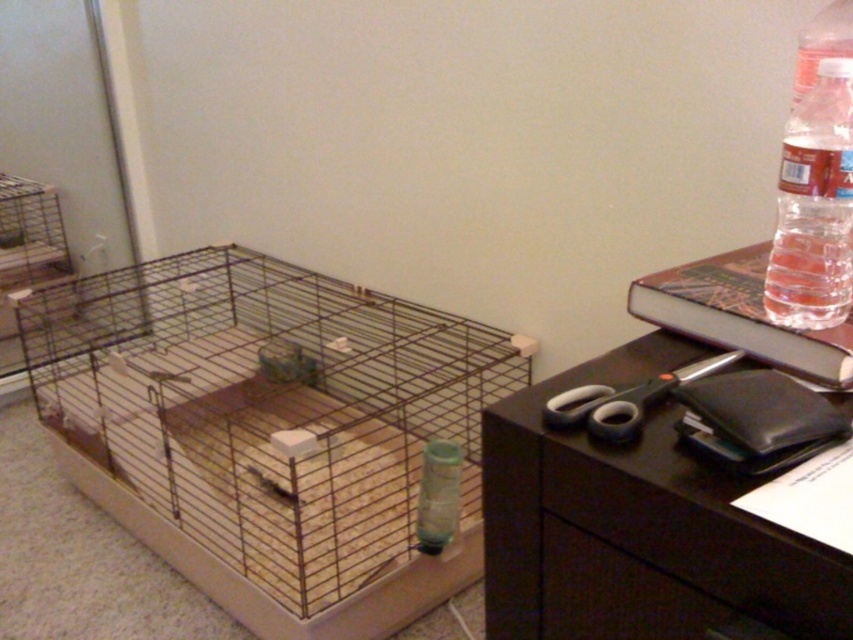
You are standing in front of the cage and want to place a small treat on the closest point between point (839, 273) and point (822, 49). Which point should you choose?

Point (839, 273) is closer to the viewer than point (822, 49), so you should choose point (839, 273) to place the treat.

You are organizing your home office and need to move the brown wire bird cage at center closer to the black matte computer desk at right. Based on the scene, which direction should you move the cage to place it next to the desk?

The brown wire bird cage at center is already positioned to the left of the black matte computer desk at right. To place it next to the desk, move it to the right towards the desk.